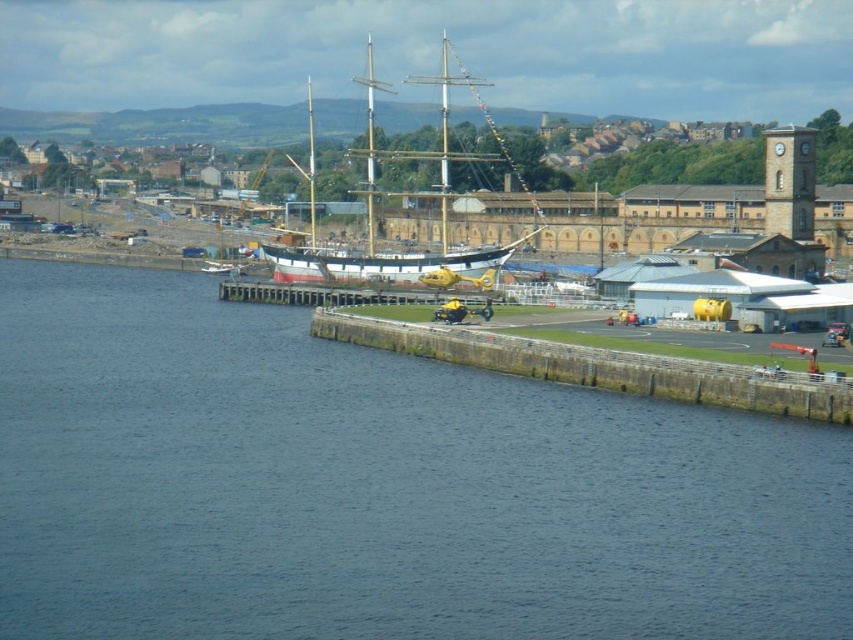
Who is positioned more to the left, blue water at lower left or yellow matte helicopter at center?

From the viewer's perspective, blue water at lower left appears more on the left side.

Can you confirm if blue water at lower left is wider than yellow matte helicopter at center?

Yes, blue water at lower left is wider than yellow matte helicopter at center.

Does point (601, 392) come farther from viewer compared to point (427, 276)?

No, it is in front of (427, 276).

This screenshot has height=640, width=853. Identify the location of blue water at lower left. (378, 486).

Looking at this image, can you confirm if blue water at lower left is smaller than white wooden ship at center?

Correct, blue water at lower left occupies less space than white wooden ship at center.

Does point (20, 294) come behind point (503, 156)?

No, it is in front of (503, 156).

Between point (416, 504) and point (372, 109), which one is positioned in front?

Point (416, 504)

I want to click on blue water at lower left, so click(378, 486).

Can you confirm if white wooden ship at center is positioned to the left of yellow matte helicopter at center?

Indeed, white wooden ship at center is positioned on the left side of yellow matte helicopter at center.

Which is in front, point (369, 84) or point (474, 282)?

Point (474, 282) is in front.

Where is `white wooden ship at center`? This screenshot has height=640, width=853. white wooden ship at center is located at coordinates (405, 196).